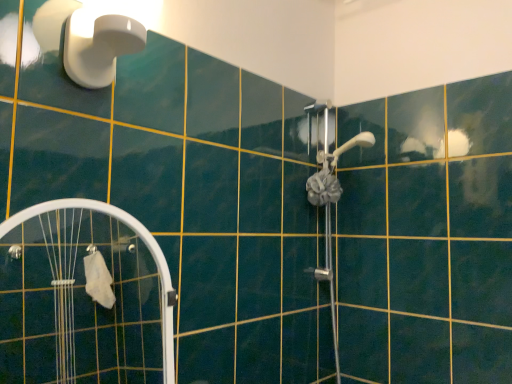
Question: Is white plastic shower at upper left further to camera compared to white translucent screen door at lower left?

Choices:
 (A) no
 (B) yes

Answer: (B)

Question: Is white plastic shower at upper left not close to white translucent screen door at lower left?

Choices:
 (A) yes
 (B) no

Answer: (A)

Question: Can you confirm if white plastic shower at upper left is bigger than white translucent screen door at lower left?

Choices:
 (A) yes
 (B) no

Answer: (B)

Question: Is white translucent screen door at lower left at the back of white plastic shower at upper left?

Choices:
 (A) no
 (B) yes

Answer: (A)

Question: From a real-world perspective, is white plastic shower at upper left positioned under white translucent screen door at lower left based on gravity?

Choices:
 (A) yes
 (B) no

Answer: (B)

Question: Does white plastic shower at upper left have a greater width compared to white translucent screen door at lower left?

Choices:
 (A) no
 (B) yes

Answer: (B)

Question: Is white translucent screen door at lower left to the right of white plastic shower at upper left from the viewer's perspective?

Choices:
 (A) no
 (B) yes

Answer: (A)

Question: Is white translucent screen door at lower left not inside white plastic shower at upper left?

Choices:
 (A) yes
 (B) no

Answer: (A)

Question: Is white translucent screen door at lower left at the left side of white plastic shower at upper left?

Choices:
 (A) yes
 (B) no

Answer: (A)

Question: Is white translucent screen door at lower left shorter than white plastic shower at upper left?

Choices:
 (A) no
 (B) yes

Answer: (A)

Question: Considering the relative sizes of white translucent screen door at lower left and white plastic shower at upper left in the image provided, is white translucent screen door at lower left bigger than white plastic shower at upper left?

Choices:
 (A) no
 (B) yes

Answer: (B)

Question: From the image's perspective, does white translucent screen door at lower left appear higher than white plastic shower at upper left?

Choices:
 (A) no
 (B) yes

Answer: (A)

Question: Is white translucent screen door at lower left wider or thinner than white plastic shower at upper left?

Choices:
 (A) thin
 (B) wide

Answer: (A)